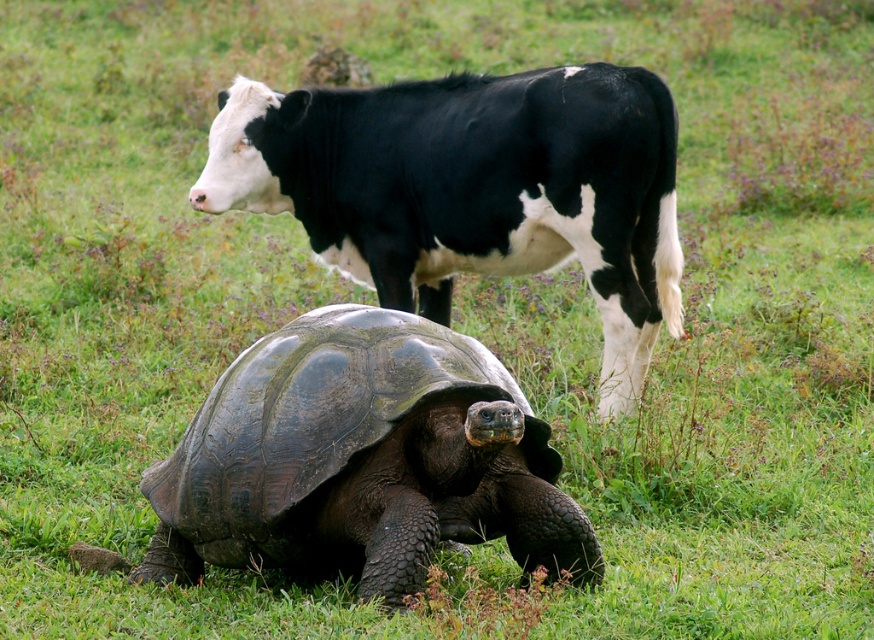
Question: Which of the following is the closest to the observer?

Choices:
 (A) (428, 339)
 (B) (551, 97)

Answer: (A)

Question: Which of the following is the farthest from the observer?

Choices:
 (A) (552, 547)
 (B) (394, 116)

Answer: (B)

Question: In this image, where is shiny dark brown tortoise at center located relative to dark brown scaly tortoise at center?

Choices:
 (A) left
 (B) right

Answer: (B)

Question: Is shiny dark brown tortoise at center below dark brown scaly tortoise at center?

Choices:
 (A) yes
 (B) no

Answer: (B)

Question: Can you confirm if shiny dark brown tortoise at center is positioned below dark brown scaly tortoise at center?

Choices:
 (A) no
 (B) yes

Answer: (A)